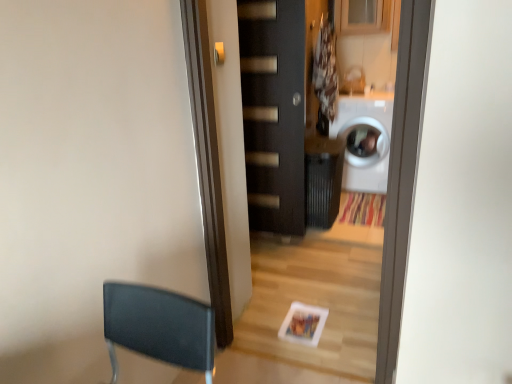
The height and width of the screenshot is (384, 512). Describe the element at coordinates (219, 53) in the screenshot. I see `satin silver door handle at upper center` at that location.

In order to face white glossy washing machine at right, should I rotate leftwards or rightwards?

You should rotate right by 14.418 degrees.

What are the coordinates of `matte black door at center` in the screenshot? It's located at (274, 112).

Is satin silver door handle at upper center touching white glossy washing machine at right?

No, satin silver door handle at upper center is not in contact with white glossy washing machine at right.

Considering the relative sizes of satin silver door handle at upper center and white glossy washing machine at right in the image provided, is satin silver door handle at upper center shorter than white glossy washing machine at right?

Indeed, satin silver door handle at upper center has a lesser height compared to white glossy washing machine at right.

Based on the photo, looking at their sizes, would you say satin silver door handle at upper center is wider or thinner than white glossy washing machine at right?

satin silver door handle at upper center is thinner than white glossy washing machine at right.

The width and height of the screenshot is (512, 384). In order to click on door handle in front of the white glossy washing machine at right in this screenshot , I will do `click(219, 53)`.

From the image's perspective, which one is positioned higher, white glossy washing machine at right or matte black door at center?

white glossy washing machine at right, from the image's perspective.

Between white glossy washing machine at right and matte black door at center, which one has more height?

matte black door at center.

Can you tell me how much white glossy washing machine at right and matte black door at center differ in facing direction?

The angular difference between white glossy washing machine at right and matte black door at center is 0.00151 degrees.

Can you tell me how much matte black door at center and white glossy washing machine at right differ in facing direction?

There is a 0.00151-degree angle between the facing directions of matte black door at center and white glossy washing machine at right.

Does point (241, 9) come closer to viewer compared to point (353, 138)?

Yes, point (241, 9) is closer to viewer.

Does matte black door at center appear on the left side of white glossy washing machine at right?

Yes, matte black door at center is to the left of white glossy washing machine at right.

Are matte black door at center and white glossy washing machine at right located far from each other?

Yes.

Is satin silver door handle at upper center outside of matte black door at center?

Yes, satin silver door handle at upper center is not within matte black door at center.

Measure the distance from satin silver door handle at upper center to matte black door at center.

3.66 feet.

Is satin silver door handle at upper center turned away from matte black door at center?

No, matte black door at center is not at the back of satin silver door handle at upper center.

Where is `door handle lying in front of the matte black door at center`? This screenshot has height=384, width=512. door handle lying in front of the matte black door at center is located at coordinates (219, 53).

From a real-world perspective, who is located lower, matte black door at center or satin silver door handle at upper center?

In real-world perspective, matte black door at center is lower.

Is matte black door at center looking in the opposite direction of satin silver door handle at upper center?

matte black door at center is not turned away from satin silver door handle at upper center.

Between matte black door at center and satin silver door handle at upper center, which one has smaller width?

satin silver door handle at upper center is thinner.

From the image's perspective, is matte black door at center above or below satin silver door handle at upper center?

Clearly, from the image's perspective, matte black door at center is below satin silver door handle at upper center.

From the image's perspective, does white glossy washing machine at right appear lower than satin silver door handle at upper center?

Yes, from the image's perspective, white glossy washing machine at right is beneath satin silver door handle at upper center.

From a real-world perspective, which object stands above the other?

From a 3D spatial view, satin silver door handle at upper center is above.

Which is in front, point (371, 170) or point (223, 53)?

Point (223, 53)

Which of these two, white glossy washing machine at right or satin silver door handle at upper center, is thinner?

With smaller width is satin silver door handle at upper center.

Locate an element on the screen. This screenshot has height=384, width=512. washing machine below the satin silver door handle at upper center (from the image's perspective) is located at coordinates pyautogui.click(x=365, y=140).

Locate an element on the screen. washing machine lying above the matte black door at center (from the image's perspective) is located at coordinates (365, 140).

When comparing their distances from white glossy washing machine at right, does matte black door at center or satin silver door handle at upper center seem closer?

Based on the image, matte black door at center appears to be nearer to white glossy washing machine at right.

When comparing their distances from white glossy washing machine at right, does satin silver door handle at upper center or matte black door at center seem further?

satin silver door handle at upper center is positioned further to the anchor white glossy washing machine at right.

Estimate the real-world distances between objects in this image. Which object is further from satin silver door handle at upper center, matte black door at center or white glossy washing machine at right?

white glossy washing machine at right lies further to satin silver door handle at upper center than the other object.

Looking at the image, which one is located closer to matte black door at center, satin silver door handle at upper center or white glossy washing machine at right?

The object closer to matte black door at center is white glossy washing machine at right.

Looking at the image, which one is located further to satin silver door handle at upper center, white glossy washing machine at right or matte black door at center?

Among the two, white glossy washing machine at right is located further to satin silver door handle at upper center.

When comparing their distances from matte black door at center, does white glossy washing machine at right or satin silver door handle at upper center seem further?

The object further to matte black door at center is satin silver door handle at upper center.

The height and width of the screenshot is (384, 512). Identify the location of door located between satin silver door handle at upper center and white glossy washing machine at right in the depth direction. (274, 112).